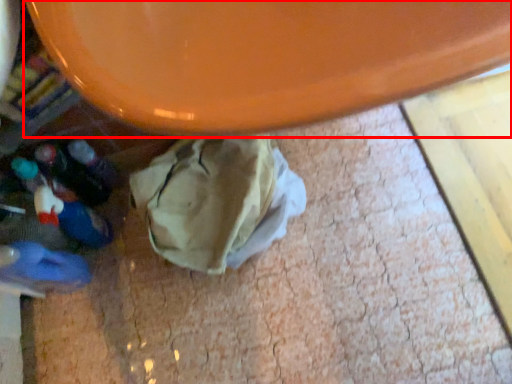
Question: Where is round table (annotated by the red box) located in relation to footwear in the image?

Choices:
 (A) left
 (B) right

Answer: (B)